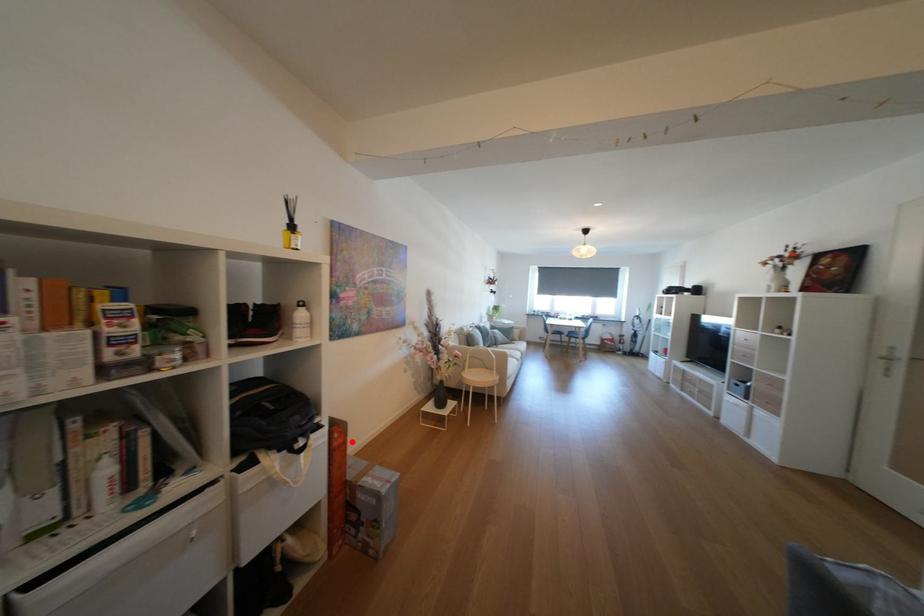
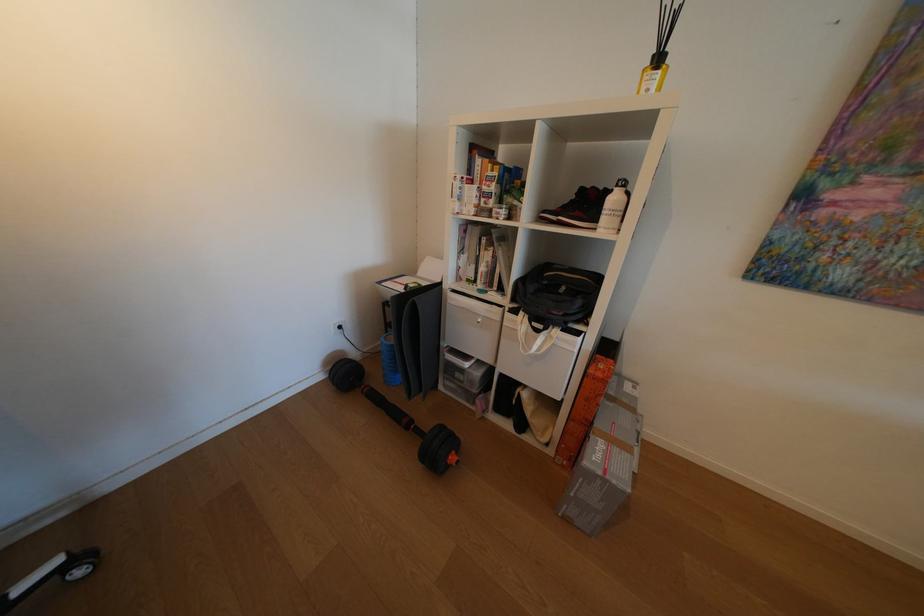
Question: A red point is marked in image1. In image2, is the corresponding 3D point closer to the camera or farther? Reply with the corresponding letter.

Choices:
 (A) The corresponding 3D point is closer.
 (B) The corresponding 3D point is farther.

Answer: (B)